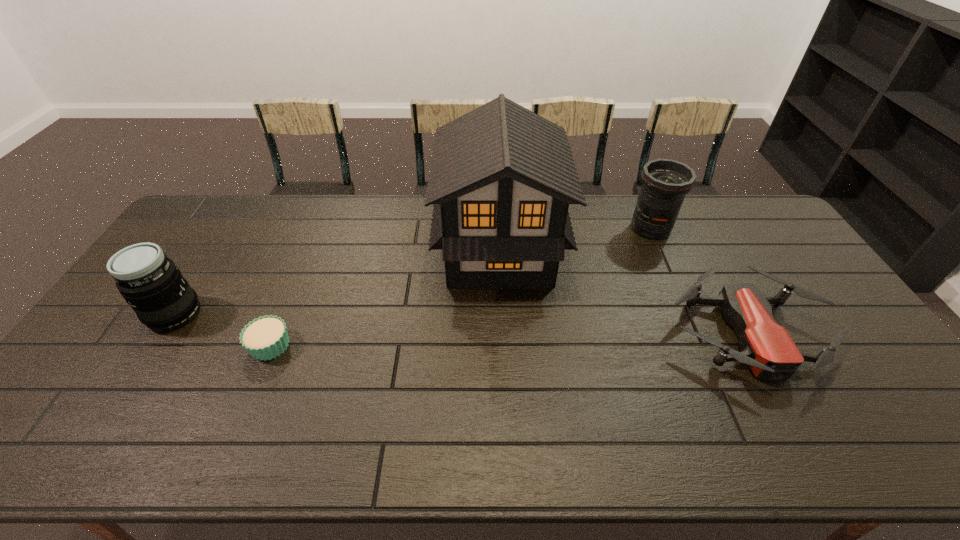
At what (x,y) coordinates should I click in order to perform the action: click on free region at the near edge. Please return your answer as a coordinate pair (x, y). This screenshot has height=540, width=960. Looking at the image, I should click on (170, 437).

Identify the location of blank space at the right edge. (845, 394).

Identify the location of free region at the far left corner of the desktop. (228, 208).

Find the location of `free location at the far right corner of the desktop`. free location at the far right corner of the desktop is located at coordinates (732, 214).

The image size is (960, 540). In the image, there is a desktop. Find the location of `vacant region at the near right corner`. vacant region at the near right corner is located at coordinates (917, 459).

This screenshot has width=960, height=540. What are the coordinates of `empty space that is in between the nearer telephoto lens and the drone` in the screenshot? It's located at (461, 323).

The width and height of the screenshot is (960, 540). I want to click on vacant space in between the drone and the second object from left to right, so click(509, 339).

Image resolution: width=960 pixels, height=540 pixels. Identify the location of free point between the tallest object and the farther telephoto lens. (575, 240).

This screenshot has height=540, width=960. In order to click on vacant region between the drone and the tallest object in this screenshot , I will do `click(623, 293)`.

Identify the location of free space that is in between the dollhouse and the shortest object. (385, 299).